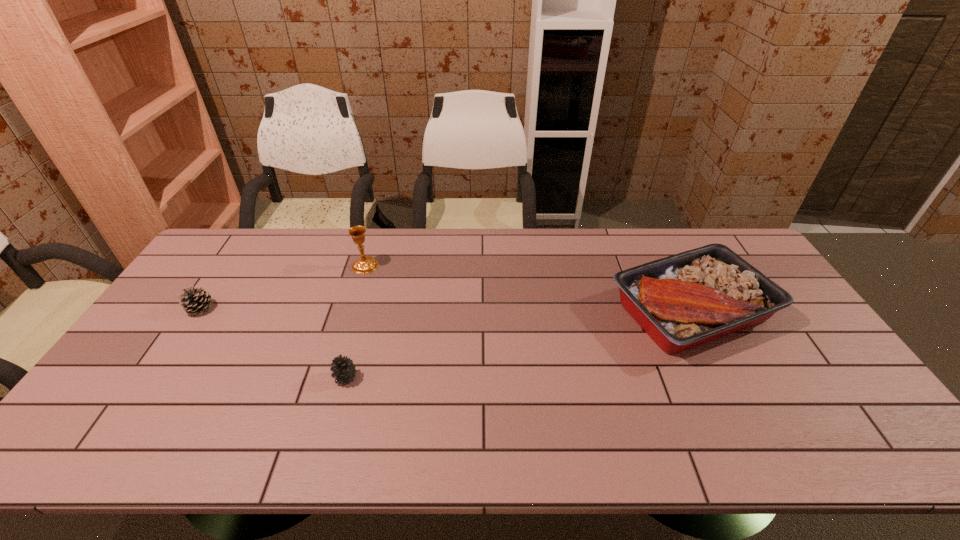
Locate an element on the screen. The image size is (960, 540). free location located 0.210m on the right of the nearer pinecone is located at coordinates (440, 377).

Image resolution: width=960 pixels, height=540 pixels. Identify the location of chalice positioned at the far edge. (367, 264).

Locate an element on the screen. This screenshot has width=960, height=540. tray that is at the far edge is located at coordinates (681, 301).

The image size is (960, 540). Identify the location of object situated at the left edge. (194, 300).

Locate an element on the screen. The width and height of the screenshot is (960, 540). object situated at the right edge is located at coordinates (681, 301).

I want to click on object at the far right corner, so click(x=681, y=301).

At what (x,y) coordinates should I click in order to perform the action: click on vacant space at the far edge. Please return your answer as a coordinate pair (x, y). The image size is (960, 540). Looking at the image, I should click on (337, 259).

This screenshot has width=960, height=540. I want to click on free space at the near edge of the desktop, so click(x=440, y=430).

This screenshot has height=540, width=960. Find the location of `blank space at the left edge`. blank space at the left edge is located at coordinates (136, 377).

Locate an element on the screen. This screenshot has width=960, height=540. free space at the right edge is located at coordinates tap(810, 422).